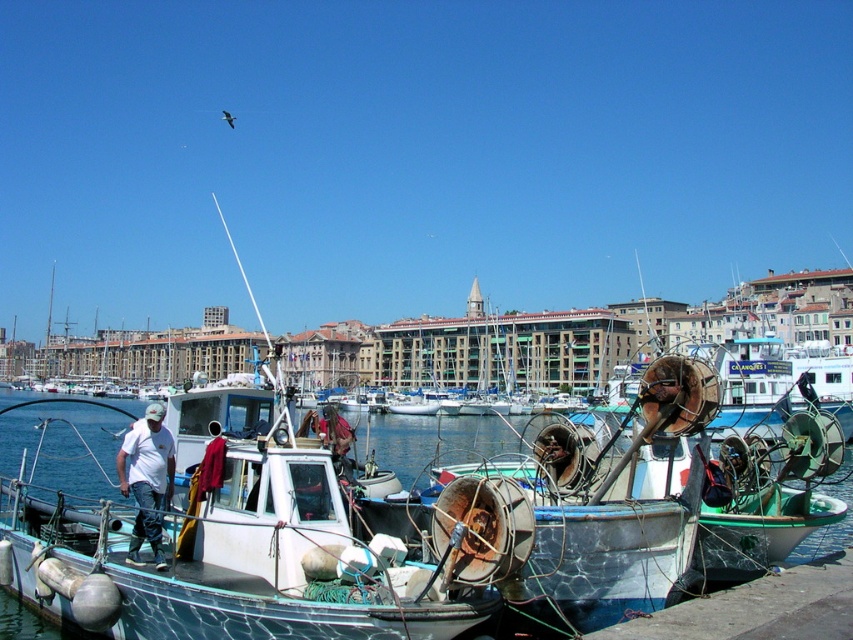
Does point (416, 461) lie in front of point (148, 422)?

No, it is not.

You are a GUI agent. You are given a task and a screenshot of the screen. Output one action in this format:
    pyautogui.click(x=<x>, y=<y>)
    Task: Click on the white matte water at center
    
    Given the screenshot: What is the action you would take?
    pyautogui.click(x=62, y=445)

Where is `white matte water at center`? white matte water at center is located at coordinates (62, 445).

At what (x,y) coordinates should I click in order to perform the action: click on white matte water at center. Please return your answer as a coordinate pair (x, y). This screenshot has width=853, height=640. Looking at the image, I should click on (62, 445).

Which of these two, white matte water at center or rusty metal helmet at center, stands shorter?

Standing shorter between the two is white matte water at center.

Can you confirm if white matte water at center is positioned below rusty metal helmet at center?

Yes.

Where is `white matte water at center`? white matte water at center is located at coordinates (62, 445).

Locate an element on the screen. The height and width of the screenshot is (640, 853). white matte shirt at center is located at coordinates (148, 480).

Between white matte shirt at center and rusty metal helmet at center, which one is positioned lower?

rusty metal helmet at center is below.

This screenshot has height=640, width=853. What are the coordinates of `white matte shirt at center` in the screenshot? It's located at (148, 480).